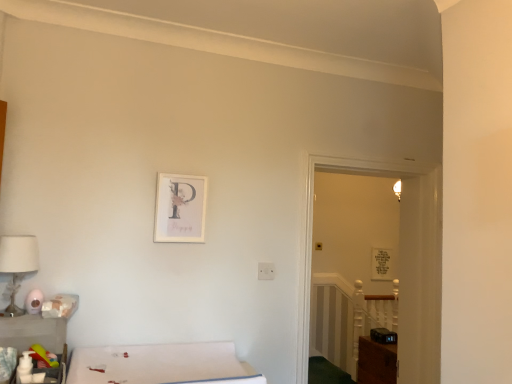
Question: Considering the relative positions of matte plastic toiletries at lower left, marked as the 1th table in a back-to-front arrangement, and clear glass door at center in the image provided, is matte plastic toiletries at lower left, marked as the 1th table in a back-to-front arrangement, in front of clear glass door at center?

Choices:
 (A) no
 (B) yes

Answer: (B)

Question: Does matte plastic toiletries at lower left, marked as the 1th table in a back-to-front arrangement, have a lesser height compared to clear glass door at center?

Choices:
 (A) no
 (B) yes

Answer: (B)

Question: Does matte plastic toiletries at lower left, arranged as the 2th table when viewed from the front, come behind clear glass door at center?

Choices:
 (A) no
 (B) yes

Answer: (A)

Question: Is matte plastic toiletries at lower left, marked as the 1th table in a back-to-front arrangement, turned away from clear glass door at center?

Choices:
 (A) yes
 (B) no

Answer: (B)

Question: From a real-world perspective, is matte plastic toiletries at lower left, arranged as the 2th table when viewed from the front, positioned over clear glass door at center based on gravity?

Choices:
 (A) yes
 (B) no

Answer: (B)

Question: Choose the correct answer: Is white fabric bed at lower left inside matte plastic toiletries at lower left, marked as the 1th table in a back-to-front arrangement, or outside it?

Choices:
 (A) inside
 (B) outside

Answer: (B)

Question: In the image, is white fabric bed at lower left on the left side or the right side of matte plastic toiletries at lower left, arranged as the 2th table when viewed from the front?

Choices:
 (A) right
 (B) left

Answer: (A)

Question: Is point (170, 369) positioned closer to the camera than point (10, 319)?

Choices:
 (A) closer
 (B) farther

Answer: (A)

Question: Considering their positions, is white fabric bed at lower left located in front of or behind matte plastic toiletries at lower left, arranged as the 2th table when viewed from the front?

Choices:
 (A) front
 (B) behind

Answer: (A)

Question: Relative to matte plastic toiletries at lower left, the first table from the front, is clear glass door at center in front or behind?

Choices:
 (A) behind
 (B) front

Answer: (A)

Question: Is clear glass door at center taller or shorter than matte plastic toiletries at lower left, arranged as the second table when viewed from the back?

Choices:
 (A) tall
 (B) short

Answer: (A)

Question: In terms of size, does clear glass door at center appear bigger or smaller than matte plastic toiletries at lower left, arranged as the second table when viewed from the back?

Choices:
 (A) small
 (B) big

Answer: (B)

Question: Considering the positions of point (362, 274) and point (60, 375), is point (362, 274) closer or farther from the camera than point (60, 375)?

Choices:
 (A) farther
 (B) closer

Answer: (A)

Question: Does point [7, 253] appear closer or farther from the camera than point [65, 319]?

Choices:
 (A) closer
 (B) farther

Answer: (A)

Question: Considering the positions of white fabric lampshade at left and matte plastic toiletries at lower left, arranged as the 2th table when viewed from the front, in the image, is white fabric lampshade at left wider or thinner than matte plastic toiletries at lower left, arranged as the 2th table when viewed from the front,?

Choices:
 (A) thin
 (B) wide

Answer: (A)